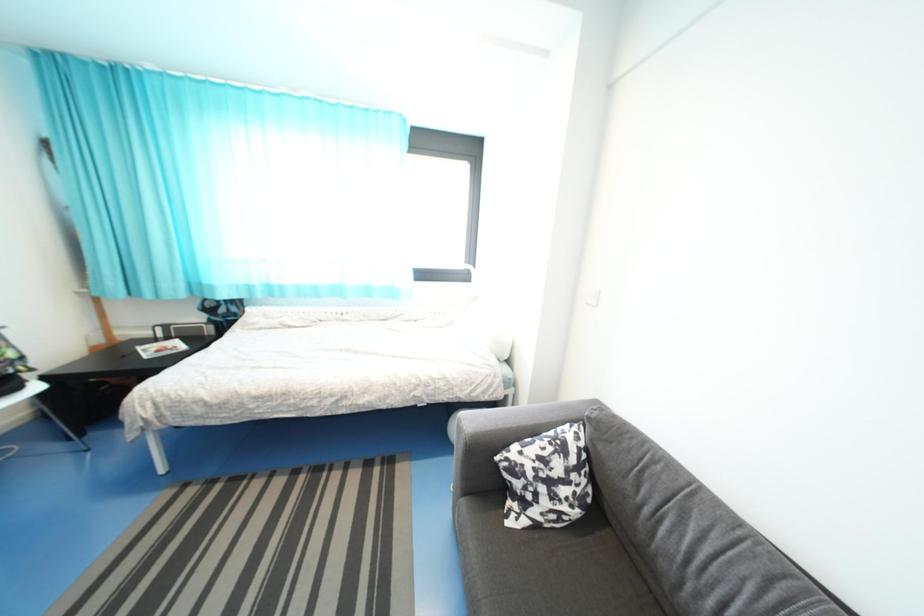
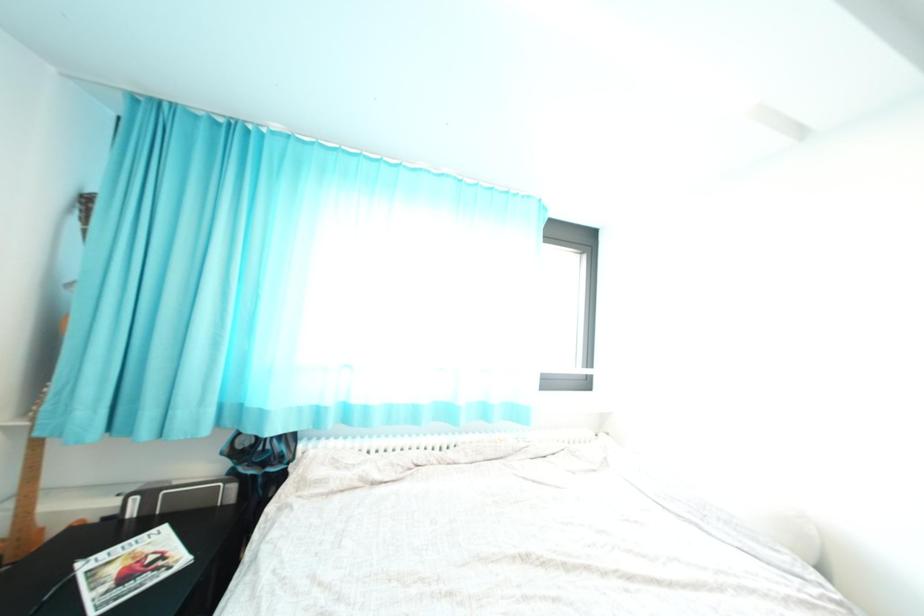
Which direction would the cameraman need to move to produce the second image?

The cameraman moved toward left, forward.